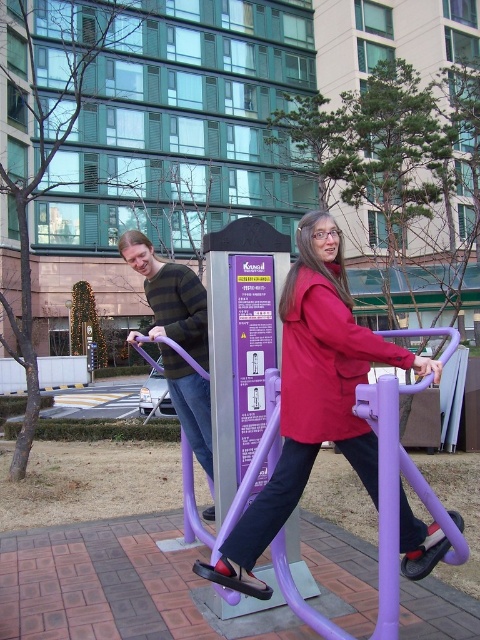
Which is more to the left, purple plastic exercise machine at center or knitted sweater at left?

knitted sweater at left

Which is below, purple plastic exercise machine at center or knitted sweater at left?

purple plastic exercise machine at center is lower down.

Which is in front, point (222, 528) or point (175, 308)?

Positioned in front is point (222, 528).

Locate an element on the screen. The width and height of the screenshot is (480, 640). purple plastic exercise machine at center is located at coordinates (396, 496).

Can you confirm if matte red jacket at center is wider than knitted sweater at left?

Incorrect, matte red jacket at center's width does not surpass knitted sweater at left's.

You are a GUI agent. You are given a task and a screenshot of the screen. Output one action in this format:
    pyautogui.click(x=<x>, y=<y>)
    Task: Click on the matte red jacket at center
    The width and height of the screenshot is (480, 640).
    Given the screenshot: What is the action you would take?
    [325, 362]

Is point (348, 356) positioned before point (172, 358)?

Yes, point (348, 356) is in front of point (172, 358).

Who is more forward, (321, 410) or (175, 371)?

Point (321, 410)

What do you see at coordinates (325, 362) in the screenshot?
I see `matte red jacket at center` at bounding box center [325, 362].

The image size is (480, 640). I want to click on matte red jacket at center, so click(325, 362).